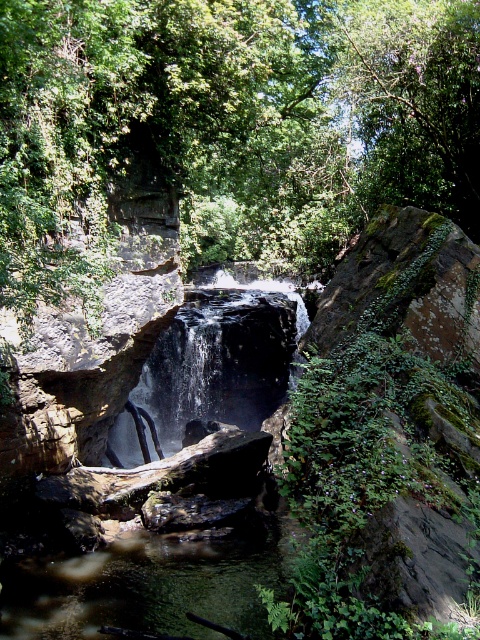
Question: Which object appears closest to the camera in this image?

Choices:
 (A) green leafy tree at center
 (B) clear water at center

Answer: (A)

Question: Considering the real-world distances, which object is farthest from the clear water at center?

Choices:
 (A) green leafy tree at center
 (B) green leafy tree at upper center

Answer: (B)

Question: Is green leafy tree at upper center below clear water at center?

Choices:
 (A) yes
 (B) no

Answer: (B)

Question: Does green leafy tree at upper center appear over clear water at center?

Choices:
 (A) no
 (B) yes

Answer: (B)

Question: Can you confirm if green leafy tree at center is positioned to the left of clear water at center?

Choices:
 (A) yes
 (B) no

Answer: (B)

Question: Which object is positioned farthest from the clear water at center?

Choices:
 (A) green leafy tree at upper center
 (B) green leafy tree at center

Answer: (A)